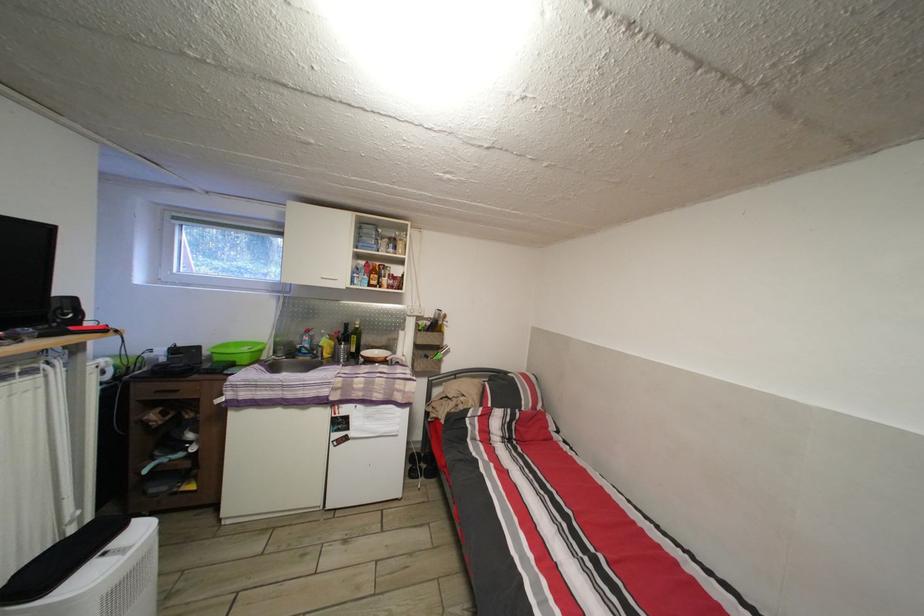
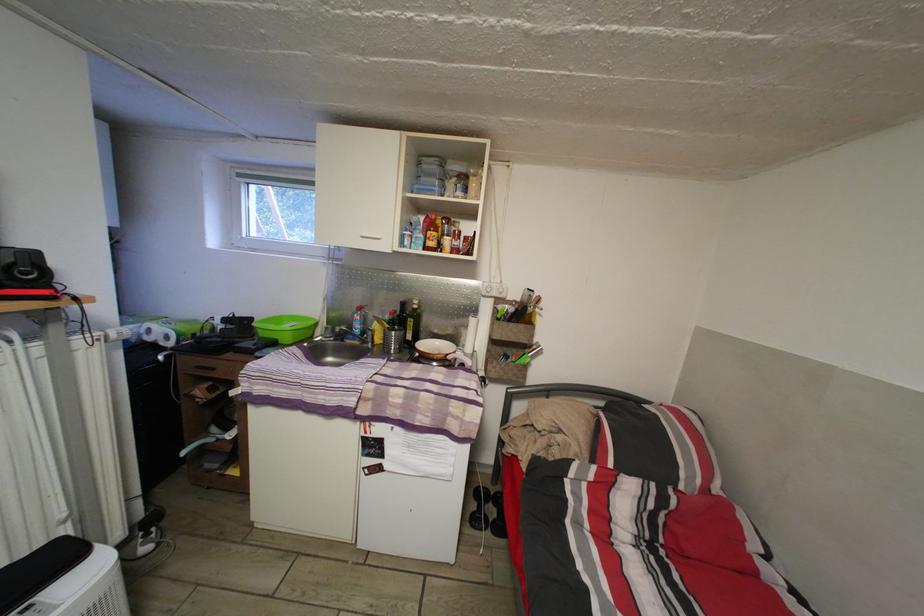
The point at (205, 354) is marked in the first image. Where is the corresponding point in the second image?

(257, 326)